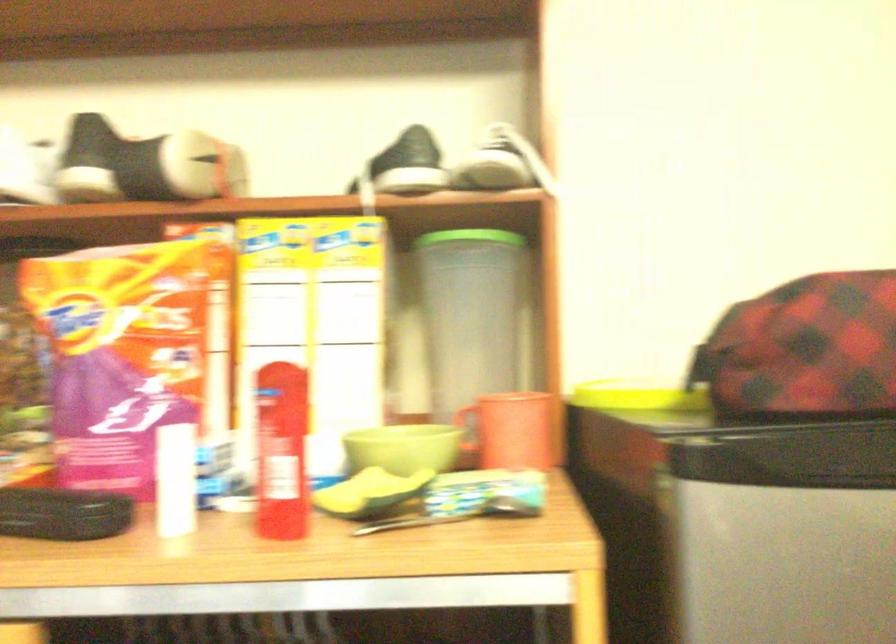
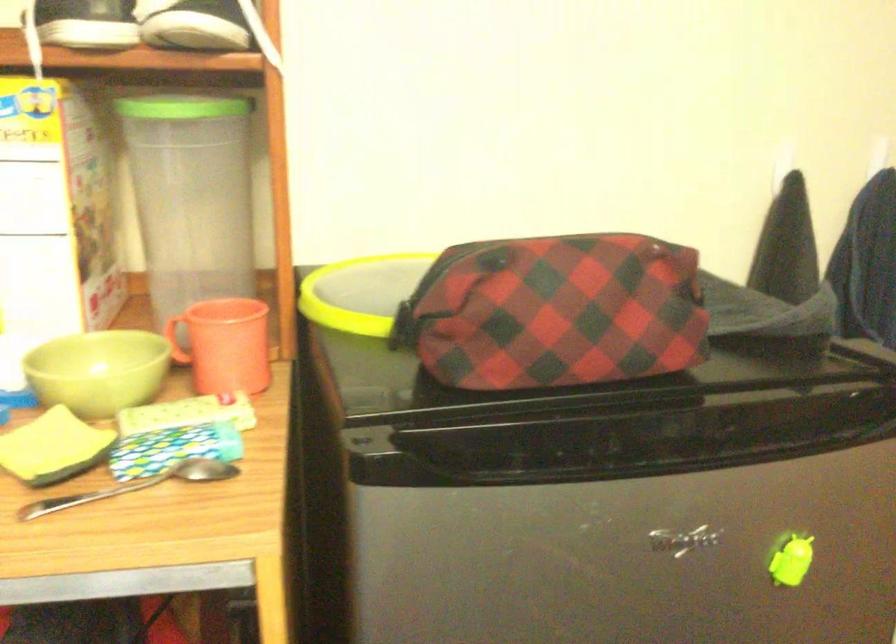
Question: The first image is from the beginning of the video and the second image is from the end. How did the camera likely rotate when shooting the video?

Choices:
 (A) Left
 (B) Right
 (C) Up
 (D) Down

Answer: (D)